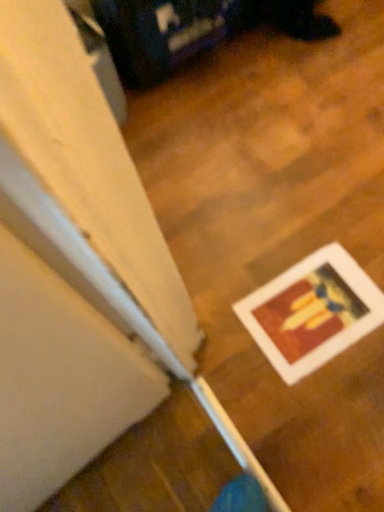
Find the location of a particular element. This screenshot has width=384, height=512. free space in front of white matte picture frame at lower right is located at coordinates (328, 410).